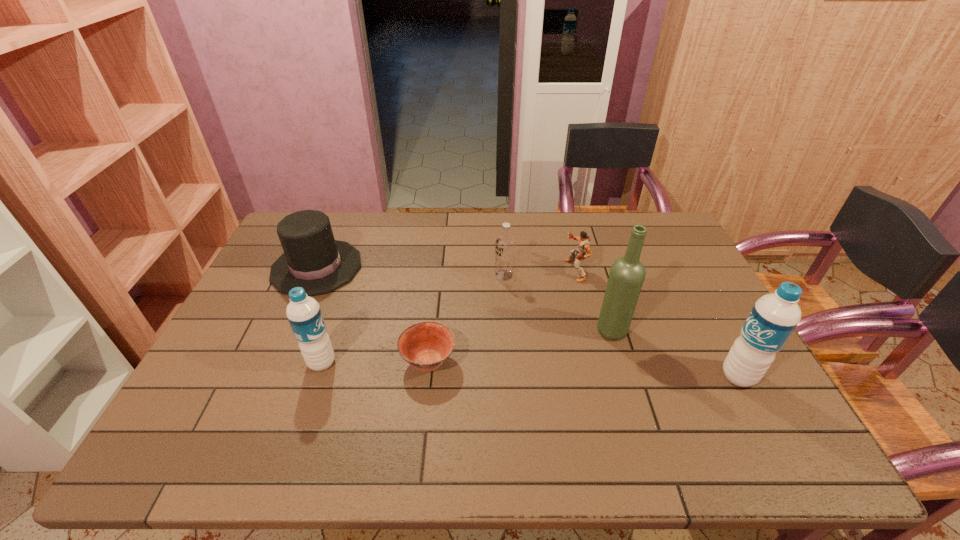
To achieve uniform spacing by inserting another water_bottle among them, please point to a free space for this new water_bottle. Please provide its 2D coordinates. Your answer should be formatted as a tuple, i.e. [(x, y)], where the tuple contains the x and y coordinates of a point satisfying the conditions above.

[(527, 369)]